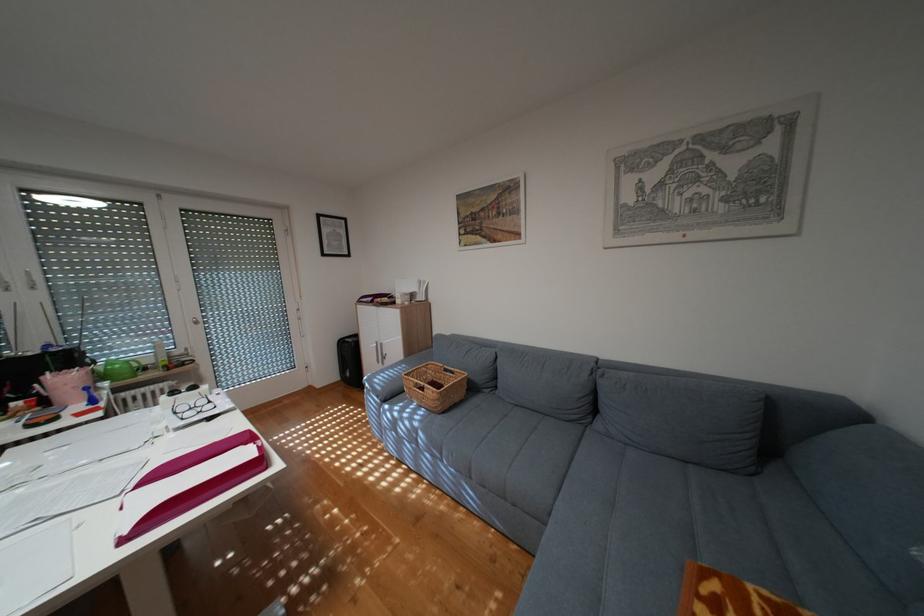
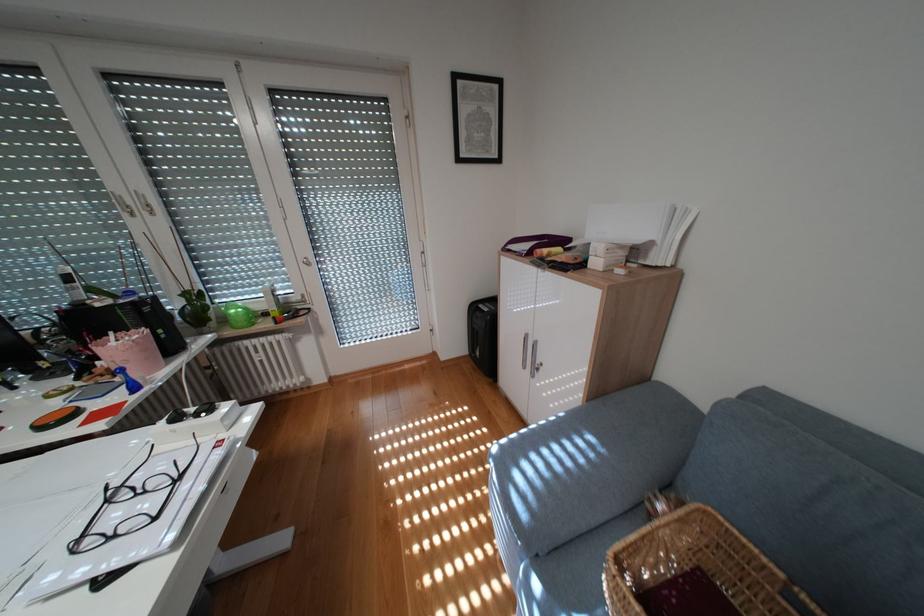
Where in the second image is the point corresponding to the point at 76,379 from the first image?

(136, 345)